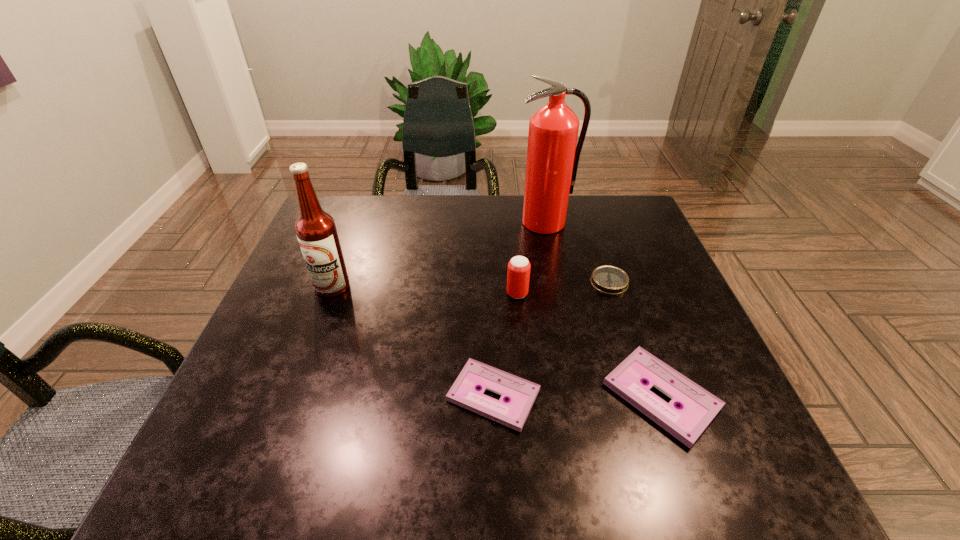
The image size is (960, 540). Identify the location of vacant place for an extra videotape on the left. (326, 395).